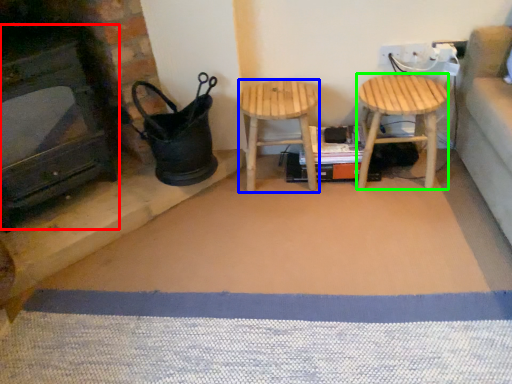
Question: Which is nearer to the fireplace (highlighted by a red box)? stool (highlighted by a blue box) or stool (highlighted by a green box).

Choices:
 (A) stool
 (B) stool

Answer: (A)